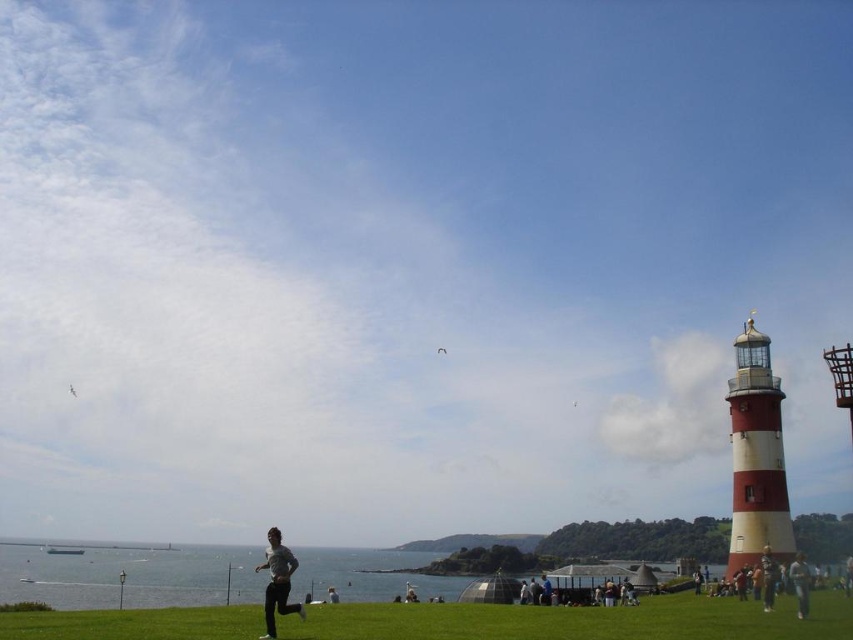
Is white cotton shirt at lower center above white matte kite at upper center?

No, white cotton shirt at lower center is not above white matte kite at upper center.

Find the location of `white cotton shirt at lower center`. white cotton shirt at lower center is located at coordinates (332, 595).

Does point (123, 552) come closer to viewer compared to point (770, 604)?

No, (123, 552) is behind (770, 604).

Does blue water at lower center have a lesser width compared to light blue denim jeans at lower right?

In fact, blue water at lower center might be wider than light blue denim jeans at lower right.

Is point (54, 595) positioned before point (764, 595)?

No.

This screenshot has height=640, width=853. In order to click on blue water at lower center in this screenshot , I will do `click(131, 576)`.

Does point (790, 579) come farther from viewer compared to point (334, 592)?

No, it is not.

Between point (802, 611) and point (329, 592), which one is positioned behind?

The point (329, 592) is more distant.

Image resolution: width=853 pixels, height=640 pixels. Find the location of `light gray cotton shirt at lower right`. light gray cotton shirt at lower right is located at coordinates pyautogui.click(x=799, y=584).